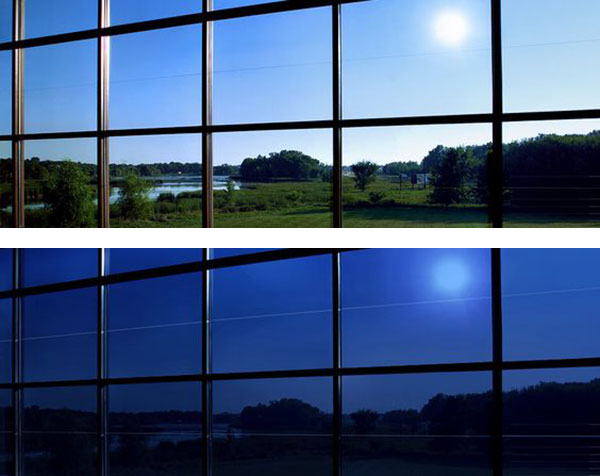
Image resolution: width=600 pixels, height=476 pixels. Find the location of `vertical window frame`. vertical window frame is located at coordinates (13, 21), (107, 16), (205, 51), (337, 53), (497, 54), (16, 356), (101, 356), (204, 361), (337, 329), (498, 327).